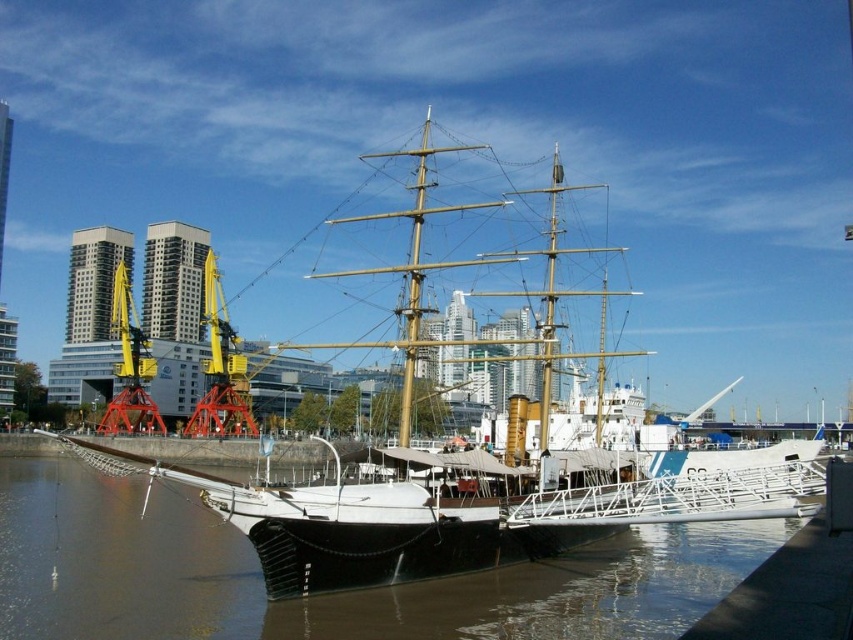
Question: Can you confirm if smooth brown water at center is smaller than white wooden ship at center?

Choices:
 (A) yes
 (B) no

Answer: (A)

Question: Is smooth brown water at center bigger than white wooden ship at center?

Choices:
 (A) yes
 (B) no

Answer: (B)

Question: Is smooth brown water at center bigger than white wooden ship at center?

Choices:
 (A) no
 (B) yes

Answer: (A)

Question: Which of the following is the closest to the observer?

Choices:
 (A) white wooden ship at center
 (B) smooth brown water at center

Answer: (B)